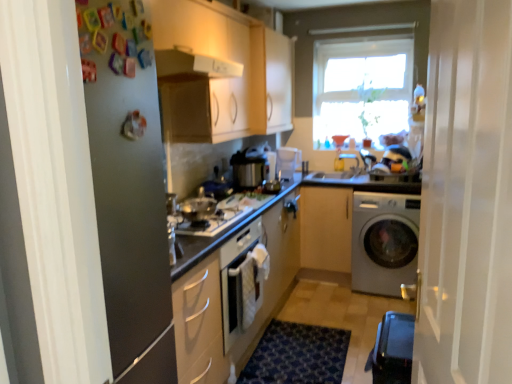
Identify the location of free space below blue textured rug at lower center (from a real-world perspective). This screenshot has height=384, width=512. (298, 357).